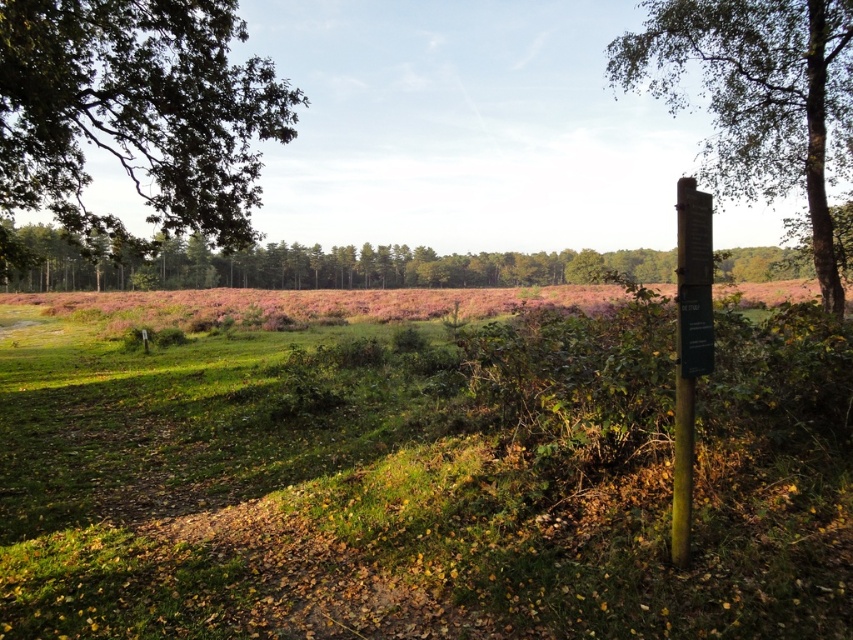
You are standing in the middle of the green grass at center and want to walk towards the green leafy tree at right. Which direction should you head to reach it?

The green leafy tree at right is located above the green grass at center, so you should head upwards to reach it.

You are standing at the origin point in the image. Which direction should you move to reach the green grass at center?

The green grass at center is located at point 0.753 on the x axis and 0.498 on the y axis, so you should move towards the right and slightly forward to reach it.